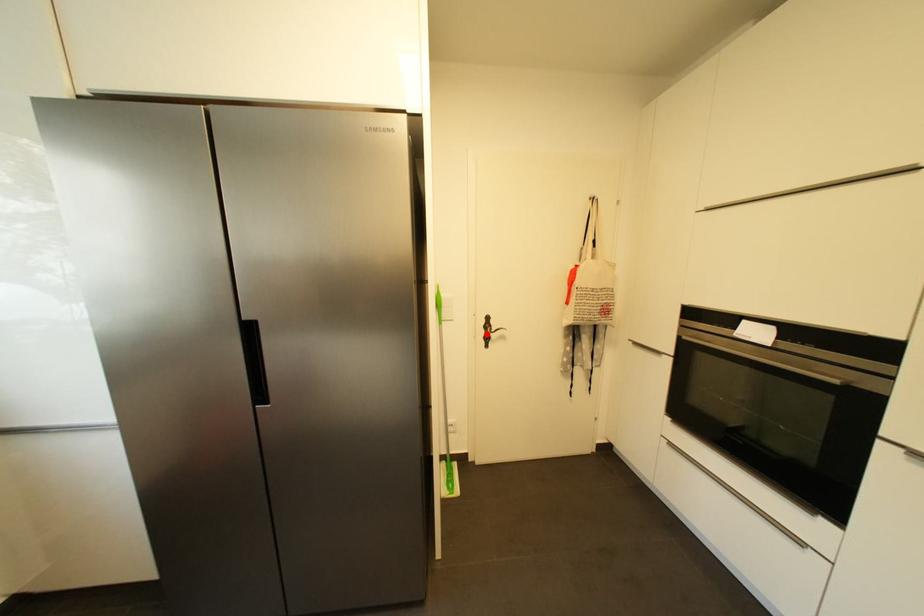
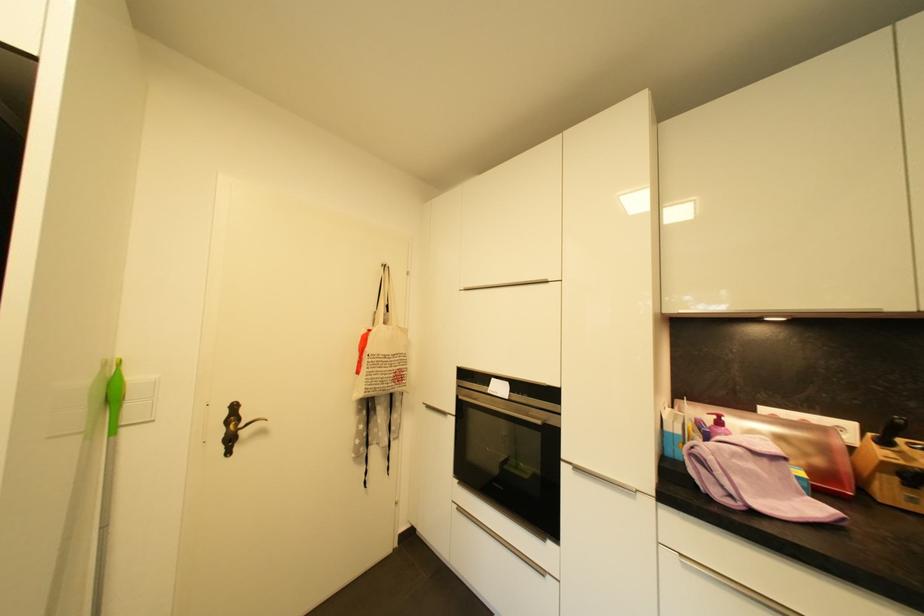
The point at the highlighted location is marked in the first image. Where is the corresponding point in the second image?

(225, 434)